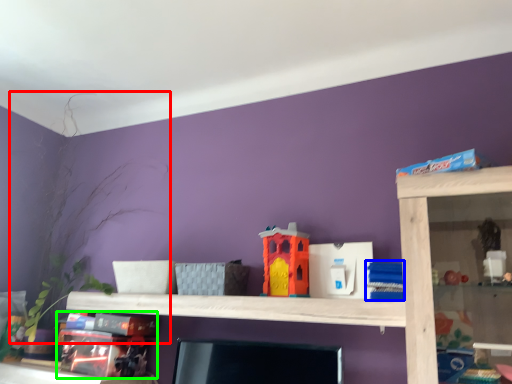
Question: Which object is the farthest from plant (highlighted by a red box)? Choose among these: toy (highlighted by a blue box) or toy (highlighted by a green box).

Choices:
 (A) toy
 (B) toy

Answer: (A)